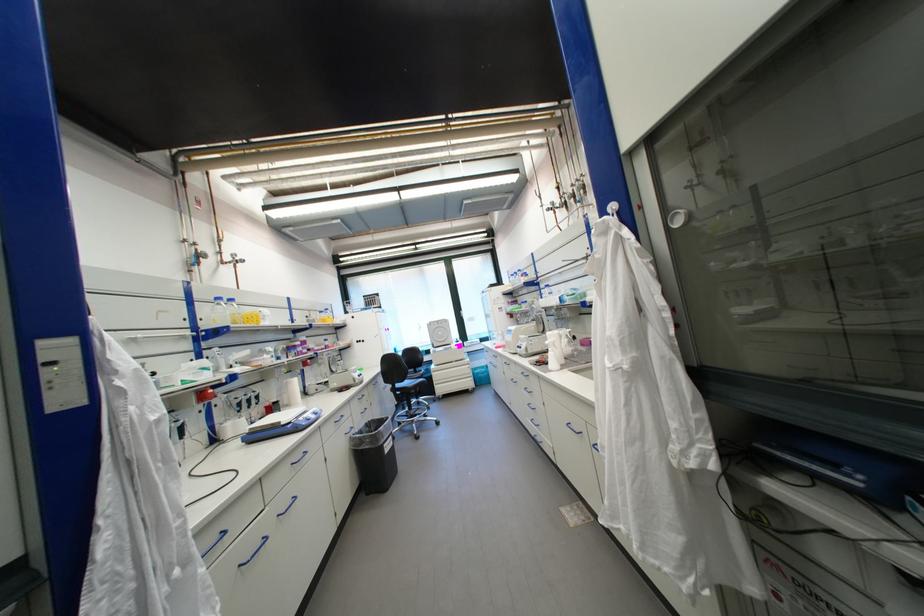
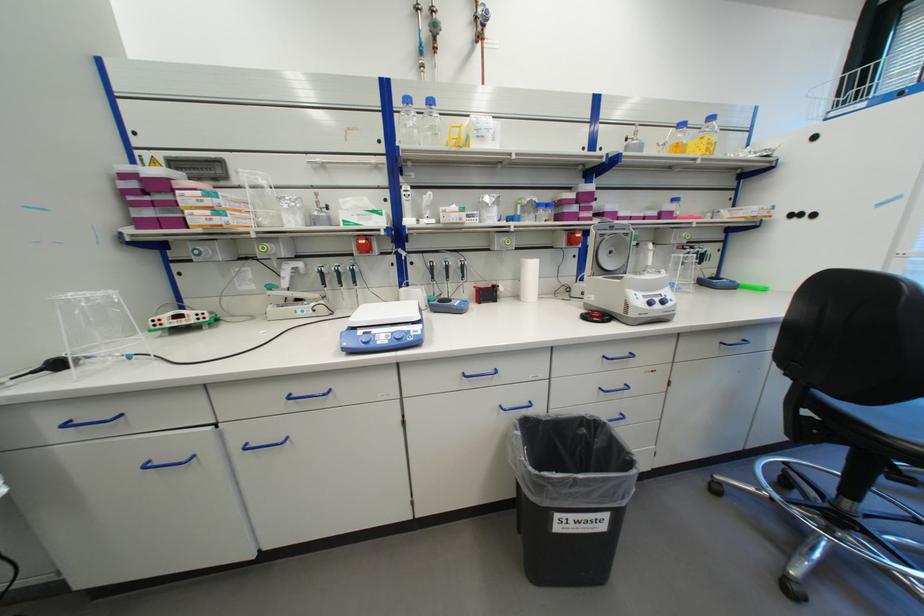
The point at (309,419) is marked in the first image. Where is the corresponding point in the second image?

(369, 333)